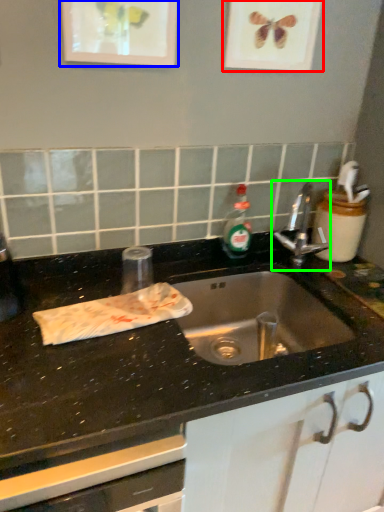
Question: Which object is positioned closest to picture frame (highlighted by a red box)? Select from picture frame (highlighted by a blue box) and tap (highlighted by a green box).

Choices:
 (A) picture frame
 (B) tap

Answer: (A)